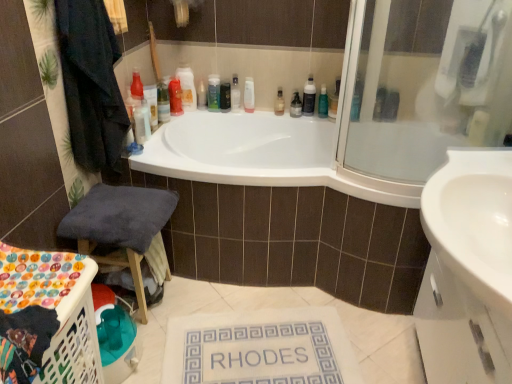
Question: Based on their positions, is white plastic laundry basket at lower left located to the left or right of matte plastic bottle at upper center, the 9th toiletry when ordered from left to right?

Choices:
 (A) right
 (B) left

Answer: (B)

Question: Would you say white plastic laundry basket at lower left is inside or outside matte plastic bottle at upper center, the second toiletry from the right?

Choices:
 (A) inside
 (B) outside

Answer: (B)

Question: Which is nearer to the translucent plastic soap dispenser at upper center, which is counted as the fifth toiletry, starting from the right?

Choices:
 (A) white glossy sink at lower right
 (B) matte plastic bottle at upper center, which is the first toiletry in right-to-left order
 (C) translucent plastic soap dispenser at upper center, marked as the 5th toiletry in a left-to-right arrangement
 (D) blue glass bottle at upper center, the 8th toiletry viewed from the left
 (E) white plastic laundry basket at lower left

Answer: (C)

Question: Estimate the real-world distances between objects in this image. Which object is farther from the dark blue fabric stool at lower left?

Choices:
 (A) translucent plastic bottle at upper center, which is the tenth toiletry in right-to-left order
 (B) matte plastic bottle at upper center, the 9th toiletry when ordered from left to right
 (C) white glossy sink at lower right
 (D) white fabric bath mat at center
 (E) green matte bottle at upper center, placed as the 4th toiletry when sorted from right to left

Answer: (E)